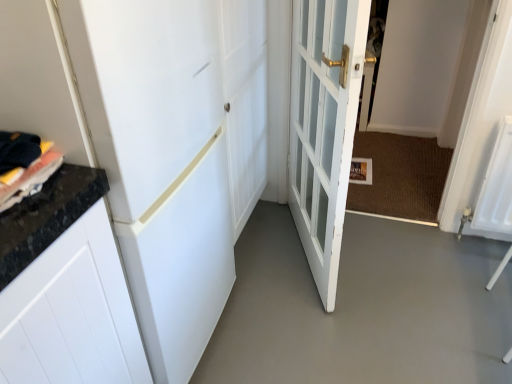
This screenshot has width=512, height=384. What do you see at coordinates (324, 126) in the screenshot? I see `white glass door at center, the second door positioned from the left` at bounding box center [324, 126].

You are a GUI agent. You are given a task and a screenshot of the screen. Output one action in this format:
    pyautogui.click(x=<x>, y=<y>)
    Task: Click on the white glass door at center, which appears as the 1th door when viewed from the right
    
    Given the screenshot: What is the action you would take?
    pyautogui.click(x=324, y=126)

The image size is (512, 384). What do you see at coordinates (172, 152) in the screenshot?
I see `white matte door at upper left, positioned as the first door in left-to-right order` at bounding box center [172, 152].

Find the location of a particular element. Image resolution: width=512 pixels, height=384 pixels. white glass door at center, the second door positioned from the left is located at coordinates (324, 126).

From a real-world perspective, who is located lower, gray smooth concrete at center or white glass door at center, the second door positioned from the left?

From a 3D spatial view, gray smooth concrete at center is below.

Is gray smooth concrete at center oriented away from white glass door at center, the second door positioned from the left?

That's not correct — gray smooth concrete at center is not looking away from white glass door at center, the second door positioned from the left.

Consider the image. From the image's perspective, which is above, gray smooth concrete at center or white glass door at center, the second door positioned from the left?

white glass door at center, the second door positioned from the left, is shown above in the image.

Looking at this image, is gray smooth concrete at center to the right of white glass door at center, the second door positioned from the left, from the viewer's perspective?

Yes.

Is white glass door at center, which appears as the 1th door when viewed from the right, smaller than gray smooth concrete at center?

No, white glass door at center, which appears as the 1th door when viewed from the right, is not smaller than gray smooth concrete at center.

You are a GUI agent. You are given a task and a screenshot of the screen. Output one action in this format:
    pyautogui.click(x=<x>, y=<y>)
    Task: Click on the concrete lying on the right of white glass door at center, the second door positioned from the left
    The image size is (512, 384).
    Given the screenshot: What is the action you would take?
    pyautogui.click(x=362, y=308)

Could you tell me if white glass door at center, the second door positioned from the left, is facing gray smooth concrete at center?

Yes, white glass door at center, the second door positioned from the left, is oriented towards gray smooth concrete at center.

Could you measure the distance between white glass door at center, the second door positioned from the left, and gray smooth concrete at center?

19.28 inches.

Is white matte door at upper left, positioned as the first door in left-to-right order, facing away from gray smooth concrete at center?

white matte door at upper left, positioned as the first door in left-to-right order, does not have its back to gray smooth concrete at center.

The image size is (512, 384). I want to click on concrete on the right of white matte door at upper left, positioned as the first door in left-to-right order, so click(x=362, y=308).

Looking at this image, from a real-world perspective, between white matte door at upper left, which is counted as the second door, starting from the right, and gray smooth concrete at center, who is vertically lower?

gray smooth concrete at center is physically lower.

Considering the sizes of white matte door at upper left, positioned as the first door in left-to-right order, and white glass door at center, the second door positioned from the left, in the image, is white matte door at upper left, positioned as the first door in left-to-right order, wider or thinner than white glass door at center, the second door positioned from the left,?

In the image, white matte door at upper left, positioned as the first door in left-to-right order, appears to be wider than white glass door at center, the second door positioned from the left.

From the image's perspective, who appears lower, white matte door at upper left, positioned as the first door in left-to-right order, or white glass door at center, the second door positioned from the left?

white matte door at upper left, positioned as the first door in left-to-right order, is shown below in the image.

Looking at this image, is white matte door at upper left, positioned as the first door in left-to-right order, next to white glass door at center, which appears as the 1th door when viewed from the right, and touching it?

They are not placed beside each other.

Is white glass door at center, which appears as the 1th door when viewed from the right, at the back of white matte door at upper left, positioned as the first door in left-to-right order?

No, white matte door at upper left, positioned as the first door in left-to-right order, is not facing away from white glass door at center, which appears as the 1th door when viewed from the right.

From a real-world perspective, who is located lower, white glass door at center, which appears as the 1th door when viewed from the right, or white matte door at upper left, which is counted as the second door, starting from the right?

white glass door at center, which appears as the 1th door when viewed from the right, from a real-world perspective.

Is white glass door at center, which appears as the 1th door when viewed from the right, situated inside white matte door at upper left, which is counted as the second door, starting from the right, or outside?

white glass door at center, which appears as the 1th door when viewed from the right, cannot be found inside white matte door at upper left, which is counted as the second door, starting from the right.

From the image's perspective, between white glass door at center, which appears as the 1th door when viewed from the right, and white matte door at upper left, which is counted as the second door, starting from the right, who is located below?

white matte door at upper left, which is counted as the second door, starting from the right, appears lower in the image.

Which is more to the right, white glass door at center, the second door positioned from the left, or white matte door at upper left, positioned as the first door in left-to-right order?

Positioned to the right is white glass door at center, the second door positioned from the left.

Based on the photo, from a real-world perspective, is gray smooth concrete at center positioned under white matte door at upper left, positioned as the first door in left-to-right order, based on gravity?

Yes, from a real-world perspective, gray smooth concrete at center is under white matte door at upper left, positioned as the first door in left-to-right order.

Considering the positions of points (474, 339) and (187, 244), is point (474, 339) farther from camera compared to point (187, 244)?

Yes, point (474, 339) is farther from viewer.

Can you confirm if gray smooth concrete at center is thinner than white matte door at upper left, which is counted as the second door, starting from the right?

Incorrect, the width of gray smooth concrete at center is not less than that of white matte door at upper left, which is counted as the second door, starting from the right.

From the image's perspective, which door is the 2nd one above the gray smooth concrete at center? Please provide its 2D coordinates.

[(324, 126)]

Locate an element on the screen. Image resolution: width=512 pixels, height=384 pixels. the 1st door positioned above the gray smooth concrete at center (from a real-world perspective) is located at coordinates (324, 126).

Considering their positions, is gray smooth concrete at center positioned further to white matte door at upper left, which is counted as the second door, starting from the right, than white glass door at center, the second door positioned from the left?

gray smooth concrete at center is positioned further to the anchor white matte door at upper left, which is counted as the second door, starting from the right.

Estimate the real-world distances between objects in this image. Which object is closer to gray smooth concrete at center, white matte door at upper left, which is counted as the second door, starting from the right, or white glass door at center, the second door positioned from the left?

Among the two, white glass door at center, the second door positioned from the left, is located nearer to gray smooth concrete at center.

Which object lies further to the anchor point gray smooth concrete at center, white glass door at center, which appears as the 1th door when viewed from the right, or white matte door at upper left, which is counted as the second door, starting from the right?

Based on the image, white matte door at upper left, which is counted as the second door, starting from the right, appears to be further to gray smooth concrete at center.

Considering their positions, is white glass door at center, the second door positioned from the left, positioned closer to white matte door at upper left, which is counted as the second door, starting from the right, than gray smooth concrete at center?

white glass door at center, the second door positioned from the left, is positioned closer to the anchor white matte door at upper left, which is counted as the second door, starting from the right.

In the scene shown: Which object lies nearer to the anchor point white glass door at center, the second door positioned from the left, white matte door at upper left, positioned as the first door in left-to-right order, or gray smooth concrete at center?

white matte door at upper left, positioned as the first door in left-to-right order, is positioned closer to the anchor white glass door at center, the second door positioned from the left.

From the image, which object appears to be farther from white glass door at center, the second door positioned from the left, gray smooth concrete at center or white matte door at upper left, positioned as the first door in left-to-right order?

Based on the image, gray smooth concrete at center appears to be further to white glass door at center, the second door positioned from the left.

You are a GUI agent. You are given a task and a screenshot of the screen. Output one action in this format:
    pyautogui.click(x=<x>, y=<y>)
    Task: Click on the door situated between white matte door at upper left, which is counted as the second door, starting from the right, and gray smooth concrete at center from left to right
    The width and height of the screenshot is (512, 384).
    Given the screenshot: What is the action you would take?
    pyautogui.click(x=324, y=126)